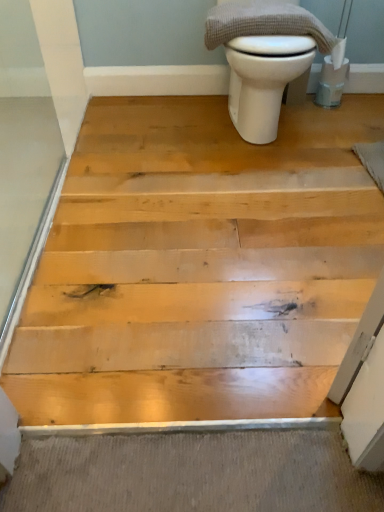
This screenshot has width=384, height=512. What are the coordinates of `waffle-knit towel at upper center` in the screenshot? It's located at (264, 23).

This screenshot has height=512, width=384. Describe the element at coordinates (264, 23) in the screenshot. I see `waffle-knit towel at upper center` at that location.

This screenshot has width=384, height=512. What are the coordinates of `waffle-knit towel at upper center` in the screenshot? It's located at (264, 23).